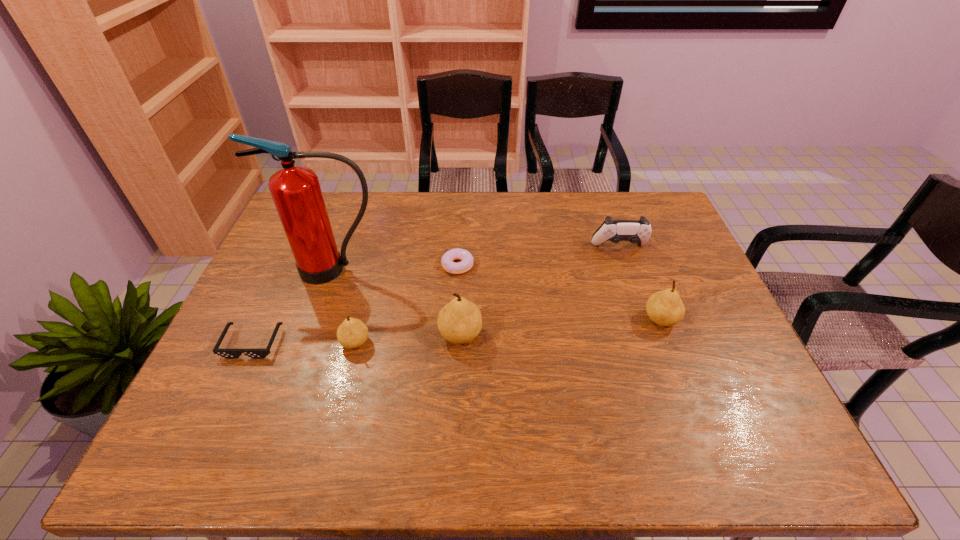
At what (x,y) coordinates should I click in order to perform the action: click on empty location between the tallest pear and the leftmost pear. Please return your answer as a coordinate pair (x, y). Looking at the image, I should click on (408, 339).

Identify the location of free spot between the doughnut and the tallest object. tap(396, 267).

Identify the location of free spot between the fire extinguisher and the third tallest object. This screenshot has height=540, width=960. (497, 294).

You are a GUI agent. You are given a task and a screenshot of the screen. Output one action in this format:
    pyautogui.click(x=<x>, y=<y>)
    Task: Click on the vacant space in between the fire extinguisher and the second tallest object
    Image resolution: width=960 pixels, height=540 pixels.
    Given the screenshot: What is the action you would take?
    pyautogui.click(x=396, y=302)

Identify the location of vacant area that lies between the second tallest pear and the doughnut. (559, 292).

Locate an element on the screen. The height and width of the screenshot is (540, 960). object that ranks as the second closest to the sunglasses is located at coordinates (296, 191).

The width and height of the screenshot is (960, 540). What are the coordinates of `object that is the third closest to the doughnut` in the screenshot? It's located at (352, 333).

Point out which pear is positioned as the nearest to the control. Please provide its 2D coordinates. Your answer should be formatted as a tuple, i.e. [(x, y)], where the tuple contains the x and y coordinates of a point satisfying the conditions above.

[(665, 308)]

Identify which pear is the second closest to the control. Please provide its 2D coordinates. Your answer should be formatted as a tuple, i.e. [(x, y)], where the tuple contains the x and y coordinates of a point satisfying the conditions above.

[(460, 321)]

Where is `blank area in the image that satisfies the following two spatial constraints: 1. on the back side of the sixth shortest object; 2. on the left side of the leftmost pear`? blank area in the image that satisfies the following two spatial constraints: 1. on the back side of the sixth shortest object; 2. on the left side of the leftmost pear is located at coordinates (357, 334).